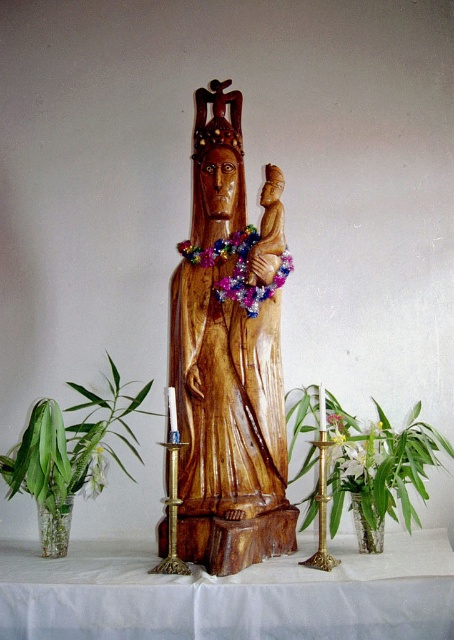
You are an interior designer arranging a living room. You have a green leafy plant at lower right and a gold polished candlestick at center. Which object is positioned to the right of the other?

The green leafy plant at lower right is positioned to the right of the gold polished candlestick at center.

You are an interior designer arranging a table. You have a green glass vase at left and a white paper flower at center. Which object is nearer to you when standing in front of the table?

The green glass vase at left is closer to the viewer than the white paper flower at center.